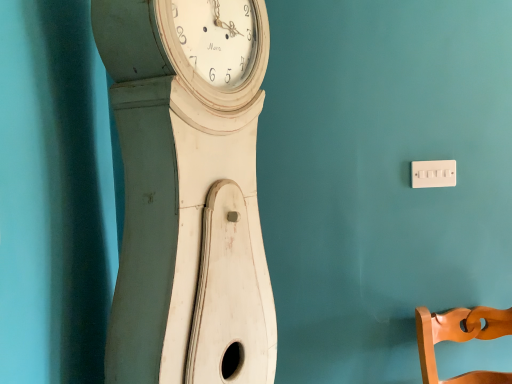
Where is `white wood wall clock at center`? This screenshot has height=384, width=512. white wood wall clock at center is located at coordinates (188, 191).

The height and width of the screenshot is (384, 512). What do you see at coordinates (188, 191) in the screenshot?
I see `white wood wall clock at center` at bounding box center [188, 191].

You are a GUI agent. You are given a task and a screenshot of the screen. Output one action in this format:
    pyautogui.click(x=<x>, y=<y>)
    Task: Click on the white wood wall clock at center
    The image size is (512, 384).
    Given the screenshot: What is the action you would take?
    pyautogui.click(x=188, y=191)